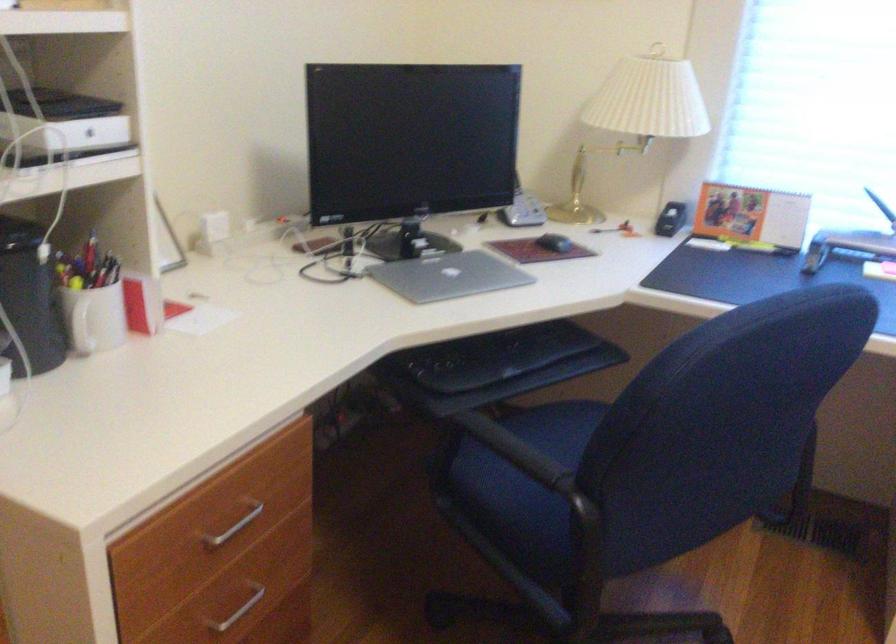
Where is `white mug handle`? Image resolution: width=896 pixels, height=644 pixels. white mug handle is located at coordinates (82, 328).